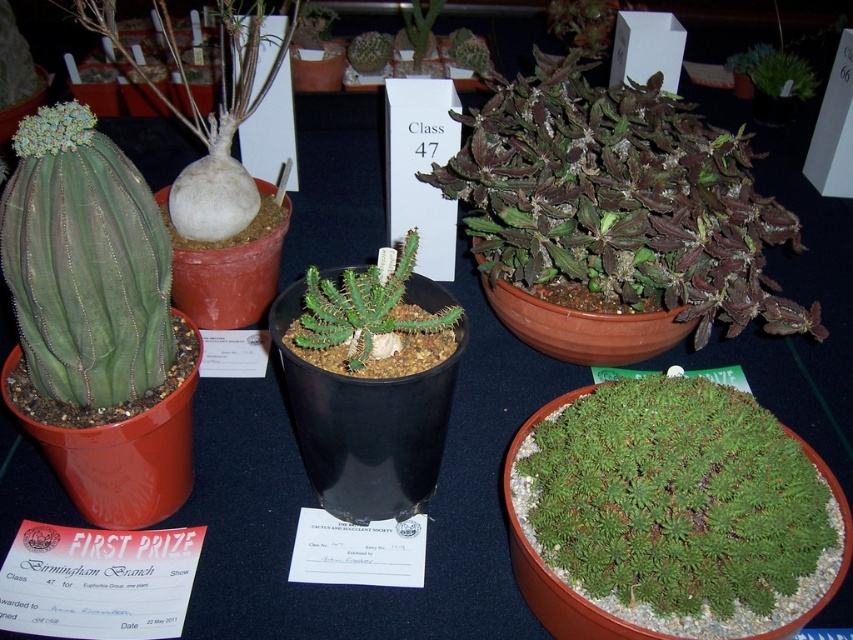
Who is positioned more to the right, dark green succulent at center or matte green succulent at center?

dark green succulent at center

Between dark green succulent at center and matte green succulent at center, which one has less height?

matte green succulent at center is shorter.

The height and width of the screenshot is (640, 853). What are the coordinates of `dark green succulent at center` in the screenshot? It's located at (619, 204).

Who is shorter, dark green leafy plant at upper center or green succulent at center?

Standing shorter between the two is dark green leafy plant at upper center.

Does point (608, 42) lie behind point (415, 68)?

Yes, it is.

This screenshot has width=853, height=640. What are the coordinates of `dark green leafy plant at upper center` in the screenshot? It's located at (585, 22).

Does green spiky cactus at center appear over green fuzzy plant at upper right?

No, green spiky cactus at center is not above green fuzzy plant at upper right.

Can you confirm if green spiky cactus at center is positioned to the right of green fuzzy plant at upper right?

Incorrect, green spiky cactus at center is not on the right side of green fuzzy plant at upper right.

Describe the element at coordinates (370, 323) in the screenshot. Image resolution: width=853 pixels, height=640 pixels. I see `green spiky cactus at center` at that location.

Image resolution: width=853 pixels, height=640 pixels. What are the coordinates of `green spiky cactus at center` in the screenshot? It's located at (370, 323).